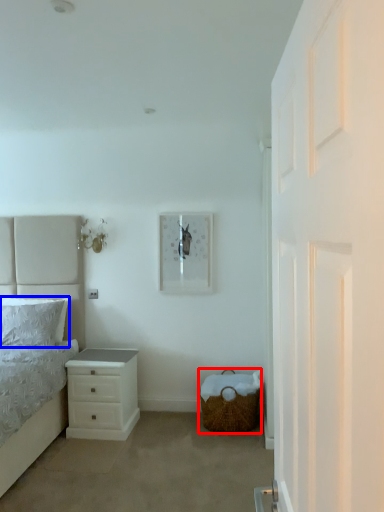
Question: Which object appears closest to the camera in this image, basket (highlighted by a red box) or pillow (highlighted by a blue box)?

Choices:
 (A) basket
 (B) pillow

Answer: (A)